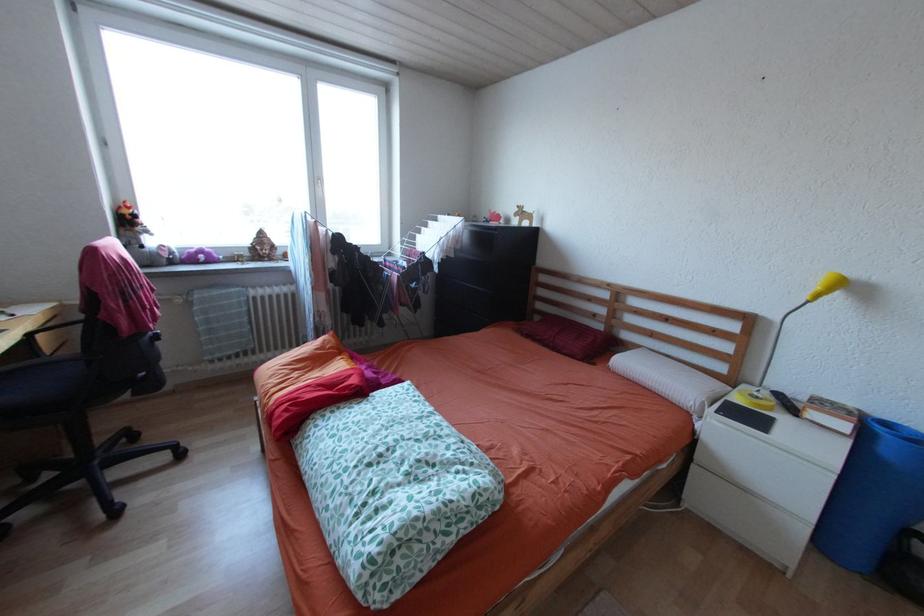
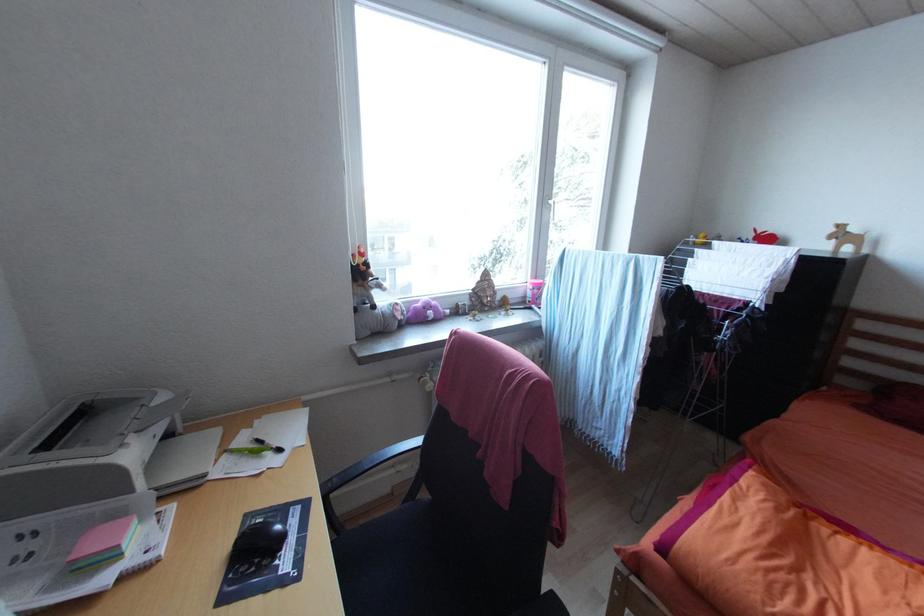
In a continuous first-person perspective shot, in which direction is the camera moving?

The cameraman walked toward left, forward.